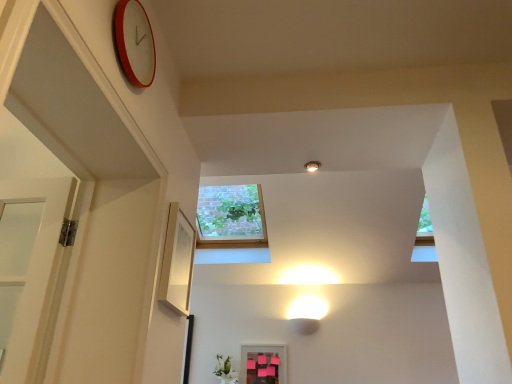
Question: Does white glossy light fixture at upper center come behind green matte vase at lower center?

Choices:
 (A) no
 (B) yes

Answer: (A)

Question: Is white glossy light fixture at upper center located outside green matte vase at lower center?

Choices:
 (A) no
 (B) yes

Answer: (B)

Question: Is white glossy light fixture at upper center smaller than green matte vase at lower center?

Choices:
 (A) yes
 (B) no

Answer: (A)

Question: Does white glossy light fixture at upper center have a greater height compared to green matte vase at lower center?

Choices:
 (A) yes
 (B) no

Answer: (B)

Question: Considering the relative sizes of white glossy light fixture at upper center and green matte vase at lower center in the image provided, is white glossy light fixture at upper center shorter than green matte vase at lower center?

Choices:
 (A) no
 (B) yes

Answer: (B)

Question: In terms of width, does green matte vase at lower center look wider or thinner when compared to white glossy light fixture at upper center?

Choices:
 (A) thin
 (B) wide

Answer: (B)

Question: In the image, is green matte vase at lower center positioned in front of or behind white glossy light fixture at upper center?

Choices:
 (A) front
 (B) behind

Answer: (B)

Question: Is point (219, 372) positioned closer to the camera than point (305, 162)?

Choices:
 (A) closer
 (B) farther

Answer: (B)

Question: In terms of height, does green matte vase at lower center look taller or shorter compared to white glossy light fixture at upper center?

Choices:
 (A) short
 (B) tall

Answer: (B)

Question: Based on their sizes in the image, would you say red plastic clock at upper left is bigger or smaller than green matte vase at lower center?

Choices:
 (A) big
 (B) small

Answer: (B)

Question: From a real-world perspective, is red plastic clock at upper left physically located above or below green matte vase at lower center?

Choices:
 (A) below
 (B) above

Answer: (B)

Question: In terms of width, does red plastic clock at upper left look wider or thinner when compared to green matte vase at lower center?

Choices:
 (A) thin
 (B) wide

Answer: (A)

Question: Is red plastic clock at upper left taller or shorter than green matte vase at lower center?

Choices:
 (A) short
 (B) tall

Answer: (B)

Question: Based on their positions, is white glossy light fixture at upper center located to the left or right of green matte vase at lower center?

Choices:
 (A) left
 (B) right

Answer: (B)

Question: In terms of width, does white glossy light fixture at upper center look wider or thinner when compared to green matte vase at lower center?

Choices:
 (A) thin
 (B) wide

Answer: (A)